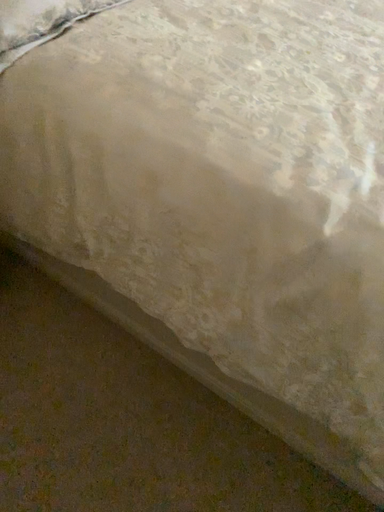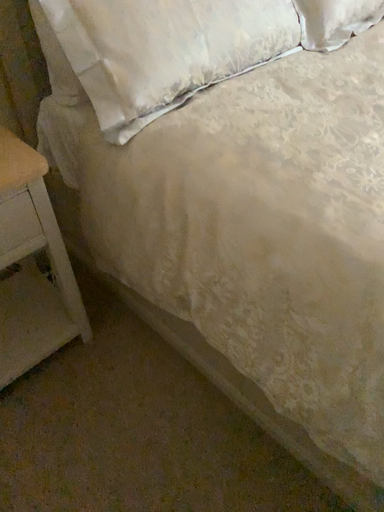
Question: Which way did the camera rotate in the video?

Choices:
 (A) rotated upward
 (B) rotated downward

Answer: (A)